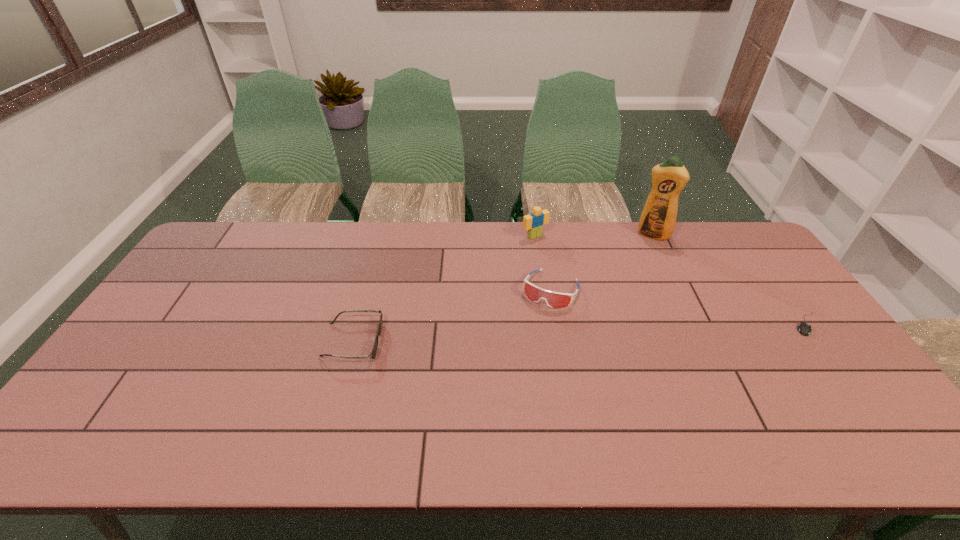
At what (x,y) coordinates should I click in order to perform the action: click on free spot on the desktop that is between the sunglasses and the rightmost object and is positioned on the label of the detergent. Please return your answer as a coordinate pair (x, y). Looking at the image, I should click on (620, 331).

Image resolution: width=960 pixels, height=540 pixels. I want to click on free space on the desktop that is between the sunglasses and the rightmost object and is positioned on the face of the Lego, so click(x=632, y=330).

I want to click on vacant space on the desktop that is between the fourth tallest object and the rightmost object and is positioned on the front-facing side of the third farthest object, so click(x=528, y=334).